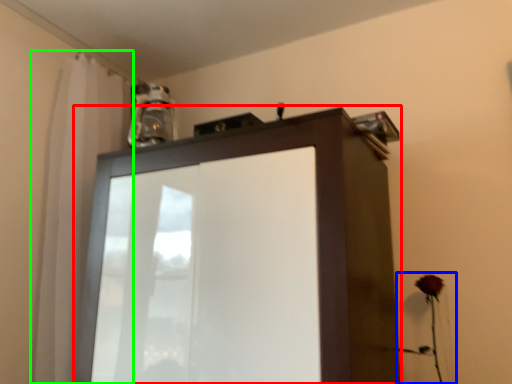
Question: Estimate the real-world distances between objects in this image. Which object is farther from cupboard (highlighted by a red box), flower (highlighted by a blue box) or shower curtain (highlighted by a green box)?

Choices:
 (A) flower
 (B) shower curtain

Answer: (A)